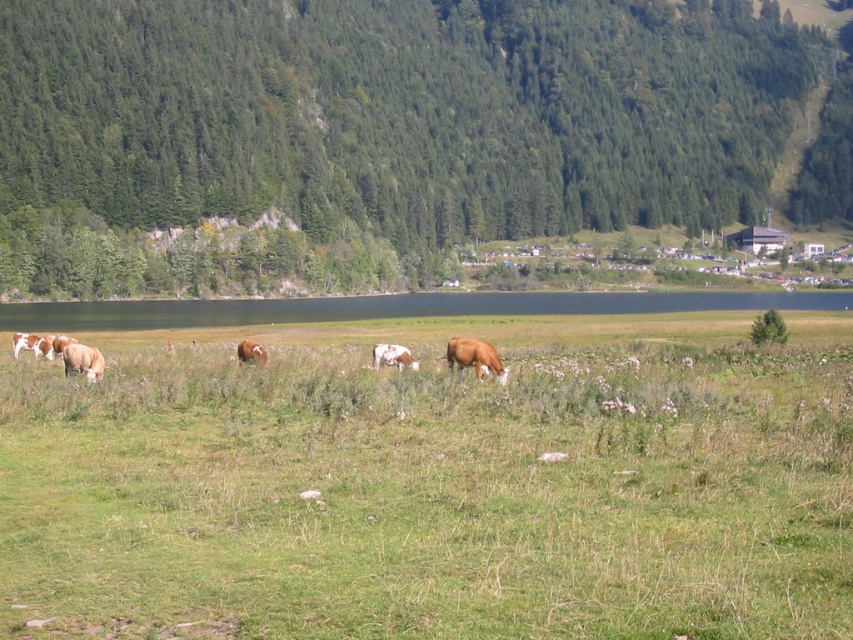
You are standing in the meadow and see the green forested hillside at upper center and the brown smooth cow at center. Which object is located to the right of the other?

The green forested hillside at upper center is positioned on the right side of brown smooth cow at center.

You are a photographer standing in the green grassy field at center and want to capture a photo of the brown and white cow at left. Since the cow is smaller than the field, how can you adjust your camera to make the cow appear larger in the photo?

Since the green grassy field at center is bigger than the brown and white cow at left, you can move closer to the brown and white cow at left to make it appear larger in the photo.